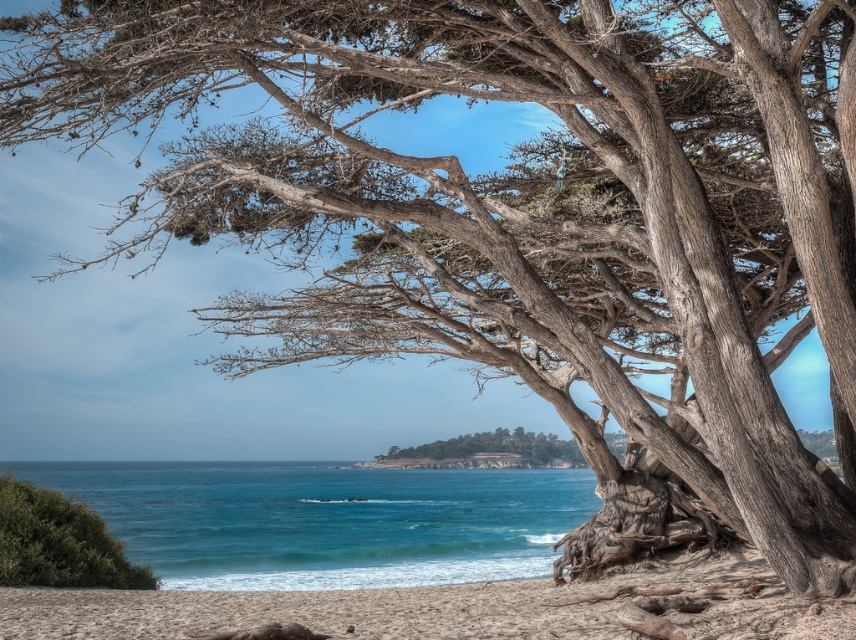
You are a photographer planning to capture a wide shot of the coastal scene. You need to ensure that both the sandy beach at lower center and the green textured island at center are fully visible in your frame. Which object should you prioritize positioning closer to the edge of the frame to avoid cropping?

The sandy beach at lower center has a greater width than the green textured island at center. To avoid cropping, prioritize positioning the wider sandy beach at lower center closer to the edge of the frame so that both can fit within the shot.

You are standing on the beach looking towards the ocean. You see the blue water at lower center and the green leafy bush at lower left. Which object is closer to you?

The green leafy bush at lower left is behind the blue water at lower center, so the blue water at lower center is closer to you.

Consider the image. You are standing on the sandy beach looking at the large, gnarled tree and the green leafy bush at lower left. Based on their positions, which object is closer to the ocean?

The green leafy bush at lower left is located at point 0.070 on the y axis, which is closer to the bottom of the image, indicating it is nearer to the ocean. Therefore, the green leafy bush at lower left is closer to the ocean.